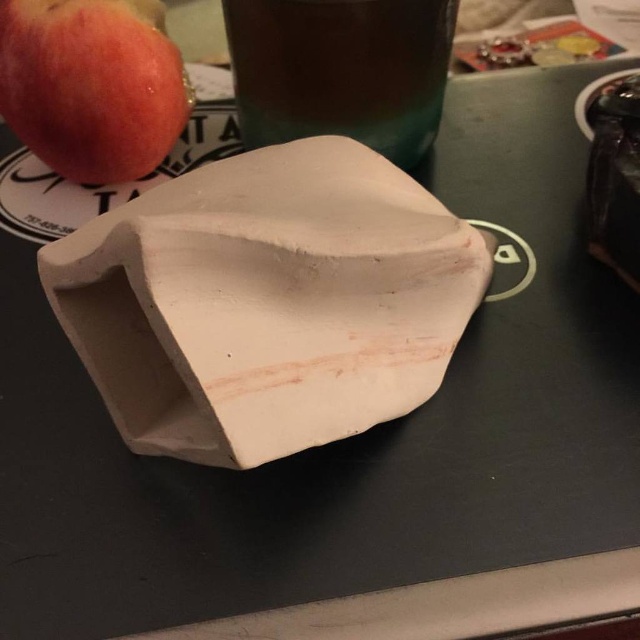
You are at a table with two items in front of you. There is a translucent glass beverage at upper center and a matte red apple at upper left. From your perspective, which item is closer to you?

The translucent glass beverage at upper center is closer to you because the matte red apple at upper left is behind it.

You are an interior designer arranging items on a table. You have a white clay vase at center and a translucent glass beverage at upper center. Which object takes up more space on the table?

The white clay vase at center is larger in size than the translucent glass beverage at upper center, so it takes up more space on the table.